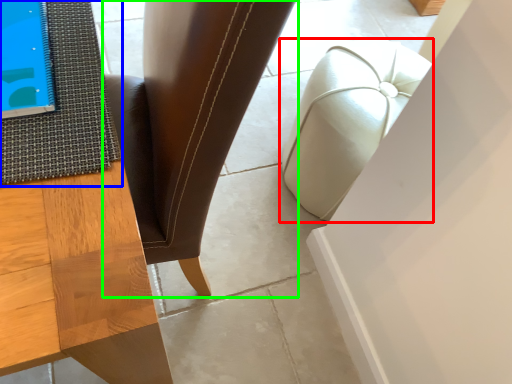
Question: Which object is positioned farthest from furniture (highlighted by a red box)? Select from mat (highlighted by a blue box) and chair (highlighted by a green box).

Choices:
 (A) mat
 (B) chair

Answer: (A)